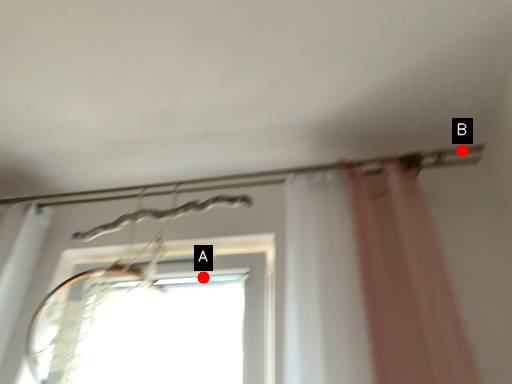
Question: Two points are circled on the image, labeled by A and B beside each circle. Which point is farther to the camera?

Choices:
 (A) A is further
 (B) B is further

Answer: (A)